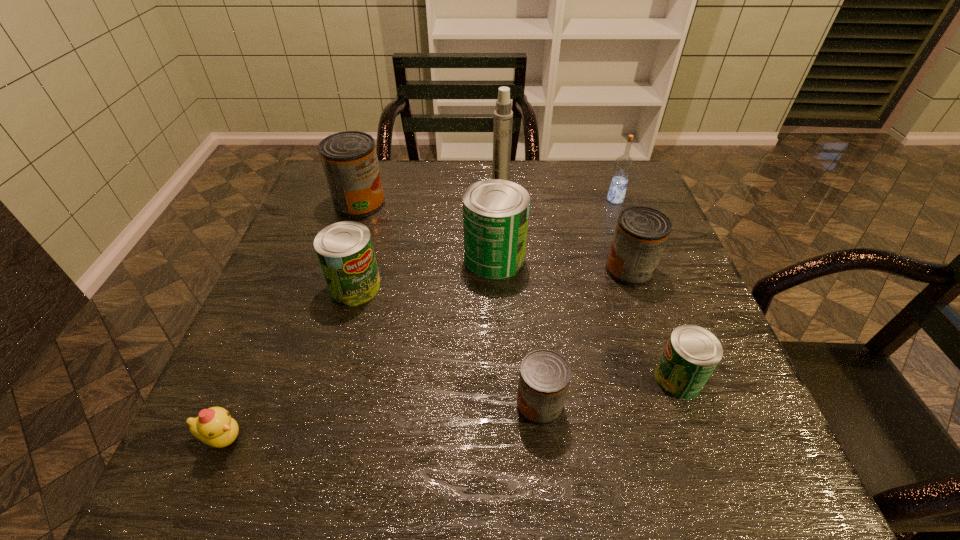
Where is `green can that stands as the closest to the rightmost green can`? The image size is (960, 540). green can that stands as the closest to the rightmost green can is located at coordinates (495, 212).

In order to click on vacant space that satisfies the following two spatial constraints: 1. on the back side of the second biggest green can; 2. on the right side of the white aerosol can in this screenshot , I will do `click(383, 189)`.

Image resolution: width=960 pixels, height=540 pixels. I want to click on free space that satisfies the following two spatial constraints: 1. on the front side of the aerosol can; 2. on the right side of the second red can from right to left, so click(513, 404).

Where is `free space that satisfies the following two spatial constraints: 1. on the back side of the vodka; 2. on the right side of the nearest green can`? free space that satisfies the following two spatial constraints: 1. on the back side of the vodka; 2. on the right side of the nearest green can is located at coordinates (612, 199).